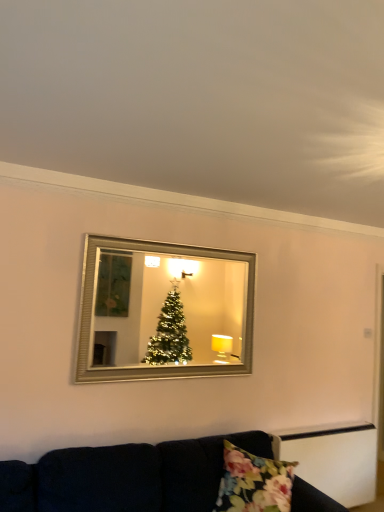
What is the approximate width of velvet dark blue couch at lower center?

1.27 meters.

Where is `silver/glass mirror at upper center`? Image resolution: width=384 pixels, height=512 pixels. silver/glass mirror at upper center is located at coordinates (170, 310).

Find the location of `velvet dark blue couch at lower center`. velvet dark blue couch at lower center is located at coordinates click(125, 476).

Is silver/glass mirror at upper center oriented away from floral fabric pillow at lower center?

No, silver/glass mirror at upper center is not facing the opposite direction of floral fabric pillow at lower center.

Locate an element on the screen. The image size is (384, 512). pillow in front of the silver/glass mirror at upper center is located at coordinates (254, 482).

Which object is thinner, silver/glass mirror at upper center or floral fabric pillow at lower center?

Thinner between the two is silver/glass mirror at upper center.

Considering their positions, is silver/glass mirror at upper center located in front of or behind floral fabric pillow at lower center?

silver/glass mirror at upper center is behind floral fabric pillow at lower center.

Can you confirm if velvet dark blue couch at lower center is bigger than floral fabric pillow at lower center?

Yes.

Is velvet dark blue couch at lower center completely or partially outside of floral fabric pillow at lower center?

velvet dark blue couch at lower center lies outside floral fabric pillow at lower center's area.

Who is more distant, velvet dark blue couch at lower center or floral fabric pillow at lower center?

floral fabric pillow at lower center is further from the camera.

Which is more to the right, velvet dark blue couch at lower center or silver/glass mirror at upper center?

velvet dark blue couch at lower center is more to the right.

Is velvet dark blue couch at lower center not near silver/glass mirror at upper center?

Indeed, velvet dark blue couch at lower center is not near silver/glass mirror at upper center.

Is velvet dark blue couch at lower center inside the boundaries of silver/glass mirror at upper center, or outside?

The correct answer is: outside.

Where is `mirror above the velvet dark blue couch at lower center (from a real-world perspective)`? mirror above the velvet dark blue couch at lower center (from a real-world perspective) is located at coordinates click(x=170, y=310).

Is floral fabric pillow at lower center aimed at velvet dark blue couch at lower center?

Yes, floral fabric pillow at lower center is oriented towards velvet dark blue couch at lower center.

From a real-world perspective, is floral fabric pillow at lower center beneath velvet dark blue couch at lower center?

No, from a real-world perspective, floral fabric pillow at lower center is not under velvet dark blue couch at lower center.

Which of these two, floral fabric pillow at lower center or velvet dark blue couch at lower center, stands taller?

velvet dark blue couch at lower center is taller.

Is floral fabric pillow at lower center far away from velvet dark blue couch at lower center?

That's not correct — floral fabric pillow at lower center is a little close to velvet dark blue couch at lower center.

Is the depth of floral fabric pillow at lower center greater than that of silver/glass mirror at upper center?

No, floral fabric pillow at lower center is closer to the viewer.

Would you say floral fabric pillow at lower center contains silver/glass mirror at upper center?

Definitely not — silver/glass mirror at upper center is not inside floral fabric pillow at lower center.

How much distance is there between floral fabric pillow at lower center and silver/glass mirror at upper center?

floral fabric pillow at lower center is 3.45 meters from silver/glass mirror at upper center.

Considering the sizes of objects floral fabric pillow at lower center and silver/glass mirror at upper center in the image provided, who is taller, floral fabric pillow at lower center or silver/glass mirror at upper center?

silver/glass mirror at upper center is taller.

Could you tell me if silver/glass mirror at upper center is facing velvet dark blue couch at lower center?

No, silver/glass mirror at upper center does not turn towards velvet dark blue couch at lower center.

The width and height of the screenshot is (384, 512). In order to click on studio couch below the silver/glass mirror at upper center (from a real-world perspective) in this screenshot , I will do `click(125, 476)`.

From a real-world perspective, which is physically above, silver/glass mirror at upper center or velvet dark blue couch at lower center?

silver/glass mirror at upper center is physically above.

Does silver/glass mirror at upper center have a greater width compared to velvet dark blue couch at lower center?

Incorrect, the width of silver/glass mirror at upper center does not surpass that of velvet dark blue couch at lower center.

Image resolution: width=384 pixels, height=512 pixels. I want to click on mirror above the floral fabric pillow at lower center (from a real-world perspective), so click(x=170, y=310).

Where is `pillow behind the velvet dark blue couch at lower center`? pillow behind the velvet dark blue couch at lower center is located at coordinates (254, 482).

From the image, which object appears to be farther from velvet dark blue couch at lower center, floral fabric pillow at lower center or silver/glass mirror at upper center?

silver/glass mirror at upper center lies further to velvet dark blue couch at lower center than the other object.

Considering their positions, is floral fabric pillow at lower center positioned further to silver/glass mirror at upper center than velvet dark blue couch at lower center?

Among the two, floral fabric pillow at lower center is located further to silver/glass mirror at upper center.

Which object lies nearer to the anchor point silver/glass mirror at upper center, velvet dark blue couch at lower center or floral fabric pillow at lower center?

The object closer to silver/glass mirror at upper center is velvet dark blue couch at lower center.

Looking at the image, which one is located closer to velvet dark blue couch at lower center, silver/glass mirror at upper center or floral fabric pillow at lower center?

floral fabric pillow at lower center is positioned closer to the anchor velvet dark blue couch at lower center.

When comparing their distances from floral fabric pillow at lower center, does silver/glass mirror at upper center or velvet dark blue couch at lower center seem closer?

Based on the image, velvet dark blue couch at lower center appears to be nearer to floral fabric pillow at lower center.

When comparing their distances from floral fabric pillow at lower center, does velvet dark blue couch at lower center or silver/glass mirror at upper center seem closer?

velvet dark blue couch at lower center.

Locate an element on the screen. pillow between velvet dark blue couch at lower center and silver/glass mirror at upper center from front to back is located at coordinates (x=254, y=482).